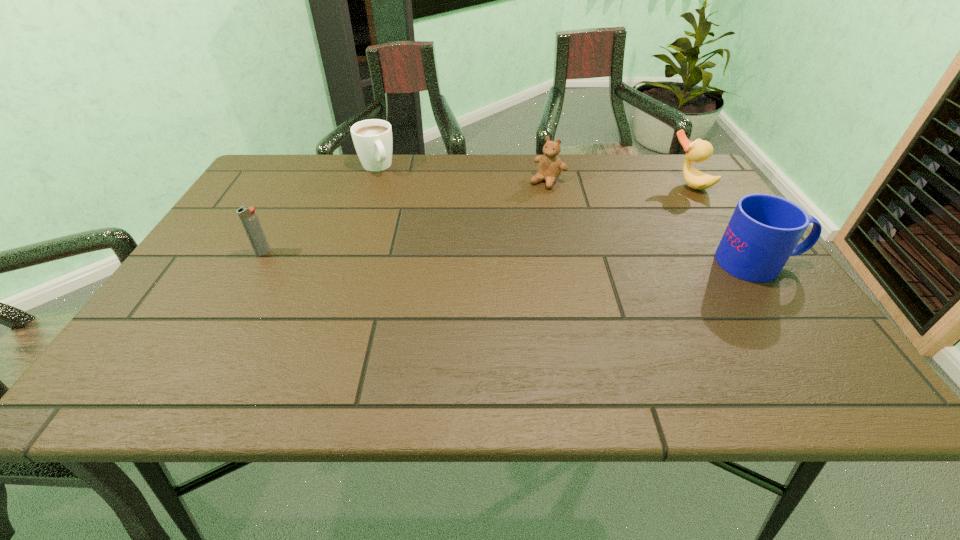
You are a GUI agent. You are given a task and a screenshot of the screen. Output one action in this format:
    pyautogui.click(x=<x>, y=<y>)
    Task: Click on the duck at the right edge
    The image size is (960, 540).
    Given the screenshot: What is the action you would take?
    pyautogui.click(x=699, y=150)

Image resolution: width=960 pixels, height=540 pixels. Find the location of `object that is positioned at the far right corner`. object that is positioned at the far right corner is located at coordinates (699, 150).

Locate an element on the screen. The width and height of the screenshot is (960, 540). free space at the far edge of the desktop is located at coordinates (348, 186).

You are a GUI agent. You are given a task and a screenshot of the screen. Output one action in this format:
    pyautogui.click(x=<x>, y=<y>)
    Task: Click on the vacant position at the near edge of the desktop
    Image resolution: width=960 pixels, height=540 pixels.
    Given the screenshot: What is the action you would take?
    pyautogui.click(x=474, y=341)

This screenshot has height=540, width=960. In the image, there is a desktop. What are the coordinates of `vacant space at the left edge` in the screenshot? It's located at (225, 307).

Locate an element on the screen. vacant position at the right edge of the desktop is located at coordinates (671, 208).

This screenshot has width=960, height=540. In the image, there is a desktop. In order to click on free space at the far left corner in this screenshot , I will do `click(286, 160)`.

In the image, there is a desktop. Where is `vacant space at the far right corner`? This screenshot has width=960, height=540. vacant space at the far right corner is located at coordinates (652, 172).

You are a GUI agent. You are given a task and a screenshot of the screen. Output one action in this format:
    pyautogui.click(x=<x>, y=<y>)
    Task: Click on the vacant position at the near right corner of the desktop
    
    Given the screenshot: What is the action you would take?
    pyautogui.click(x=738, y=331)

Find the location of `vacant space in between the third object from right to left and the mug`. vacant space in between the third object from right to left and the mug is located at coordinates (653, 222).